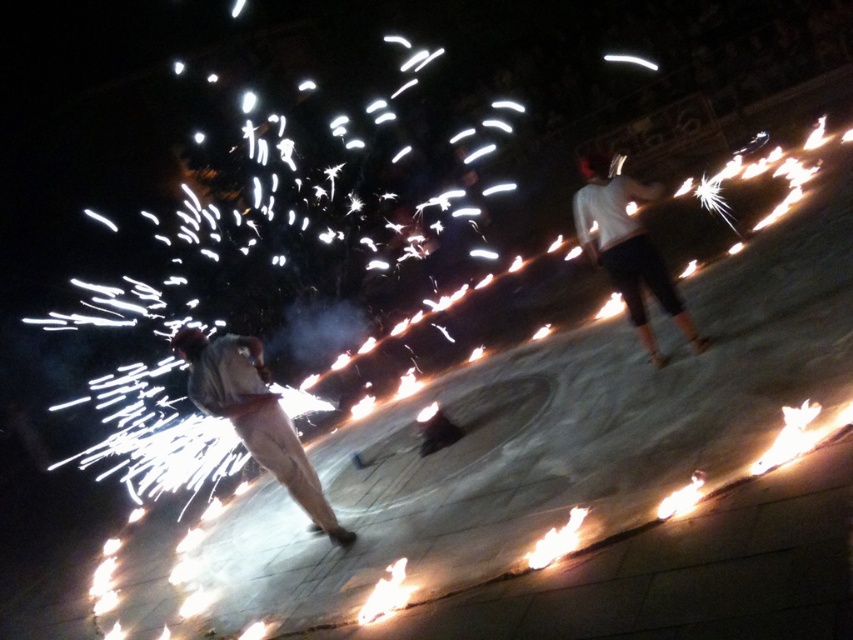
Question: Which point is closer to the camera?

Choices:
 (A) (613, 241)
 (B) (283, 460)

Answer: (B)

Question: Is light brown fabric pants at center positioned in front of white matte pants at center?

Choices:
 (A) no
 (B) yes

Answer: (B)

Question: Does light brown fabric pants at center come in front of white matte pants at center?

Choices:
 (A) yes
 (B) no

Answer: (A)

Question: Which of the following is the closest to the observer?

Choices:
 (A) white matte pants at center
 (B) light brown fabric pants at center

Answer: (B)

Question: Among these points, which one is nearest to the camera?

Choices:
 (A) (253, 369)
 (B) (643, 262)

Answer: (A)

Question: Does light brown fabric pants at center have a lesser width compared to white matte pants at center?

Choices:
 (A) no
 (B) yes

Answer: (A)